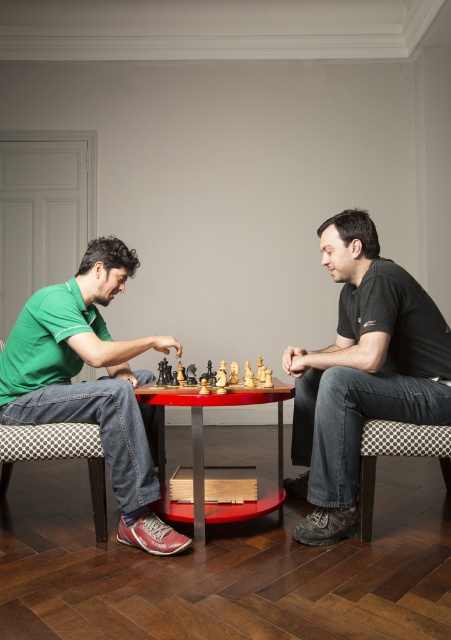
Is point (79, 428) behind point (400, 444)?

Yes, point (79, 428) is farther from viewer.

Does point (81, 444) come closer to viewer compared to point (369, 461)?

Yes, point (81, 444) is in front of point (369, 461).

Where is `patterned fabric stool at lower left`? The image size is (451, 640). patterned fabric stool at lower left is located at coordinates (58, 456).

Consider the image. Does green fabric shirt at left have a greater width compared to patterned fabric stool at lower left?

Correct, the width of green fabric shirt at left exceeds that of patterned fabric stool at lower left.

Is point (9, 397) more distant than point (92, 472)?

Yes.

Where is `green fabric shirt at left`? green fabric shirt at left is located at coordinates (92, 384).

Does point (372, 435) come behind point (263, 365)?

No, (372, 435) is closer to viewer.

Between point (423, 435) and point (224, 387), which one is positioned in front?

Point (423, 435) is in front.

Who is more forward, (x=367, y=465) or (x=230, y=380)?

Positioned in front is point (x=367, y=465).

The image size is (451, 640). In order to click on patterned fabric stool at lower right in this screenshot , I will do `click(396, 456)`.